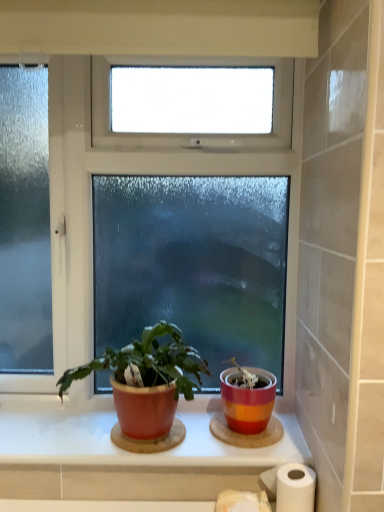
Question: Can you confirm if white paper at lower right is positioned to the left of white matte toilet paper at lower center?

Choices:
 (A) no
 (B) yes

Answer: (A)

Question: Is white paper at lower right facing away from white matte toilet paper at lower center?

Choices:
 (A) yes
 (B) no

Answer: (B)

Question: From the image's perspective, would you say white paper at lower right is shown under white matte toilet paper at lower center?

Choices:
 (A) yes
 (B) no

Answer: (B)

Question: Considering the relative sizes of white paper at lower right and white matte toilet paper at lower center in the image provided, is white paper at lower right smaller than white matte toilet paper at lower center?

Choices:
 (A) yes
 (B) no

Answer: (B)

Question: Is the position of white paper at lower right more distant than that of white matte toilet paper at lower center?

Choices:
 (A) yes
 (B) no

Answer: (A)

Question: Is white matte toilet paper at lower center located within white paper at lower right?

Choices:
 (A) yes
 (B) no

Answer: (B)

Question: Considering the relative sizes of white paper at lower right and clear glass window at center in the image provided, is white paper at lower right shorter than clear glass window at center?

Choices:
 (A) yes
 (B) no

Answer: (A)

Question: Does white paper at lower right have a larger size compared to clear glass window at center?

Choices:
 (A) yes
 (B) no

Answer: (B)

Question: Does white paper at lower right lie in front of clear glass window at center?

Choices:
 (A) no
 (B) yes

Answer: (B)

Question: Does white paper at lower right have a greater width compared to clear glass window at center?

Choices:
 (A) no
 (B) yes

Answer: (A)

Question: Does white paper at lower right appear on the right side of clear glass window at center?

Choices:
 (A) yes
 (B) no

Answer: (A)

Question: Is clear glass window at center surrounded by white paper at lower right?

Choices:
 (A) yes
 (B) no

Answer: (B)

Question: Is matte ceramic window sill at center positioned far away from matte red pot at center?

Choices:
 (A) yes
 (B) no

Answer: (B)